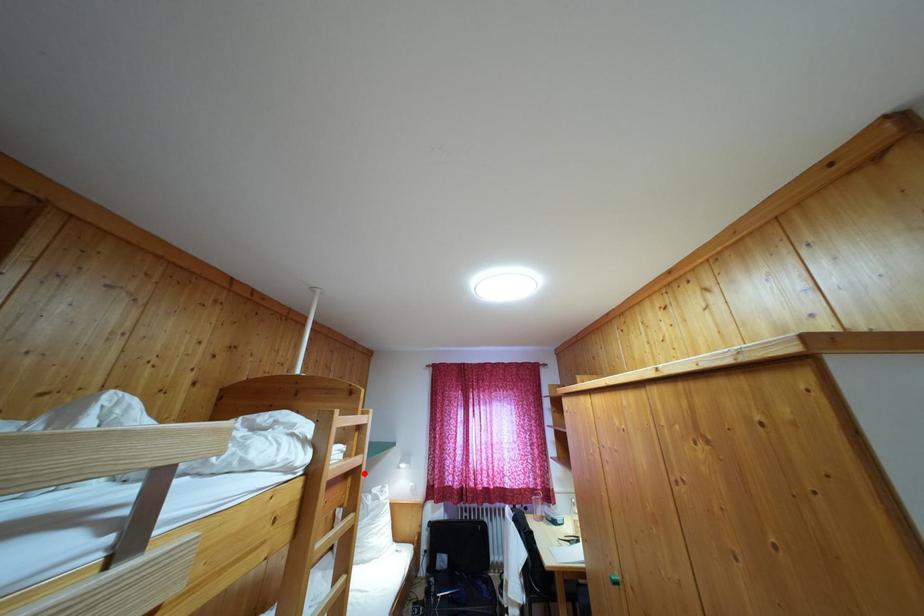
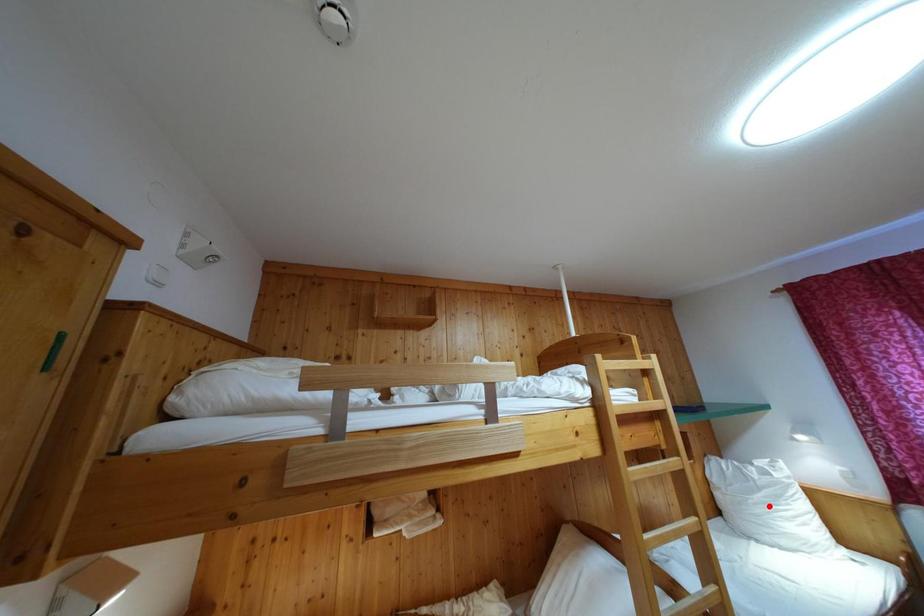
I am providing you with two images of the same scene from different viewpoints. A red point is marked on the first image and another point is marked on the second image. Does the point marked in image1 correspond to the same location as the one in image2?

No